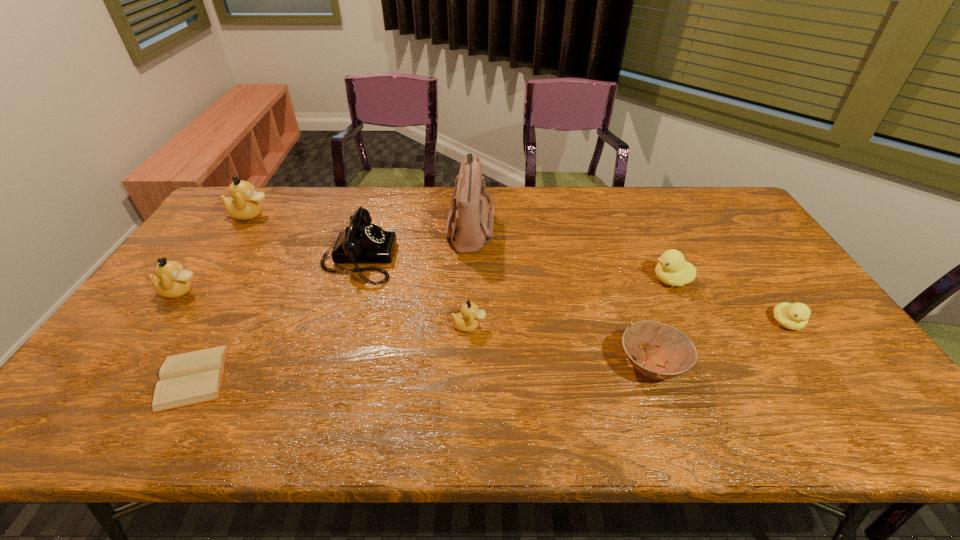
What are the coordinates of `the nearer yellow duckling` in the screenshot? It's located at (795, 316).

Where is `the smaller yellow duckling`? the smaller yellow duckling is located at coordinates (795, 316).

The width and height of the screenshot is (960, 540). Find the location of `the seventh object from left to right`. the seventh object from left to right is located at coordinates (676, 354).

I want to click on brown bowl, so click(676, 354).

The width and height of the screenshot is (960, 540). I want to click on the shortest object, so click(x=193, y=377).

The image size is (960, 540). I want to click on vacant space located 0.060m on the front pocket of the shoulder bag, so click(513, 226).

Where is `free region located on the face of the farthest duckling`? Image resolution: width=960 pixels, height=540 pixels. free region located on the face of the farthest duckling is located at coordinates (376, 214).

Image resolution: width=960 pixels, height=540 pixels. In order to click on free space located 0.380m on the dial of the sixth object from right to left in this screenshot , I will do `click(516, 259)`.

The width and height of the screenshot is (960, 540). What are the coordinates of `vacant space located 0.080m on the face of the second smallest tan duckling` in the screenshot? It's located at (228, 291).

The width and height of the screenshot is (960, 540). I want to click on vacant space located 0.310m at the beak of the second duckling from right to left, so click(545, 280).